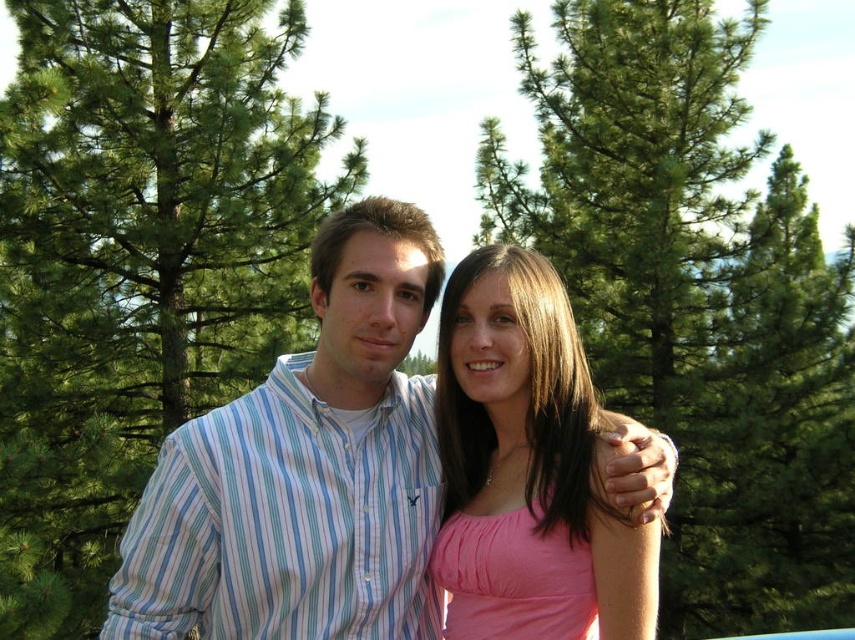
You are a photographer trying to capture a portrait of the two people in the image. You want to ensure that the pink satin dress at center is visible in the frame without being blocked by the green leafy tree at center. Based on their positions, is this possible?

The green leafy tree at center is positioned on the left side of the pink satin dress at center. Since the tree is to the left of the dress, the photographer can angle the camera to the right to ensure the pink satin dress at center remains visible and unobstructed by the tree.